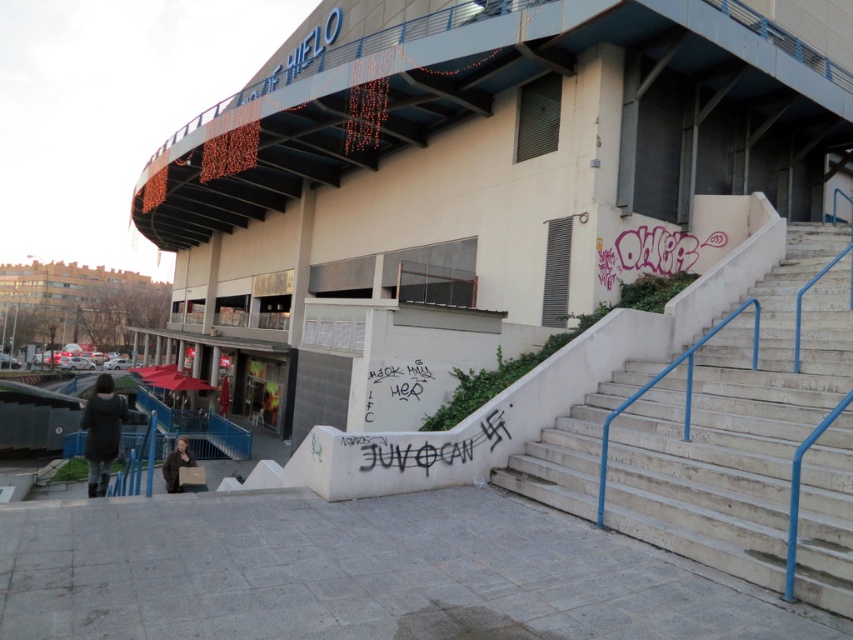
Is white concrete stairs at right closer to camera compared to black graffiti at lower center?

That is True.

Is point (666, 484) in front of point (486, 429)?

That is True.

The width and height of the screenshot is (853, 640). In order to click on white concrete stairs at right in this screenshot , I will do `click(737, 422)`.